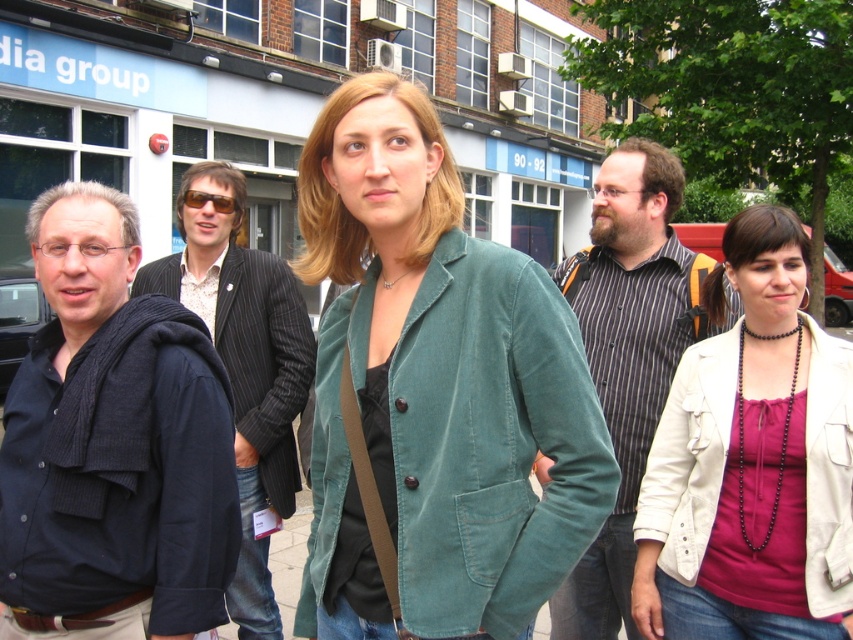
Question: Which object is positioned farthest from the striped cotton shirt at center?

Choices:
 (A) teal corduroy jacket at center
 (B) dark blue corduroy jacket at left

Answer: (B)

Question: Is dark blue corduroy jacket at left below white leather jacket at lower right?

Choices:
 (A) no
 (B) yes

Answer: (A)

Question: Which point appears closest to the camera in this image?

Choices:
 (A) (192, 426)
 (B) (259, 572)

Answer: (A)

Question: Which of these objects is positioned closest to the dark blue corduroy jacket at left?

Choices:
 (A) black pinstripe suit at center
 (B) teal corduroy jacket at center
 (C) striped cotton shirt at center
 (D) white leather jacket at lower right

Answer: (B)

Question: Is striped cotton shirt at center further to camera compared to white leather jacket at lower right?

Choices:
 (A) yes
 (B) no

Answer: (B)

Question: Can you confirm if dark blue corduroy jacket at left is thinner than black pinstripe suit at center?

Choices:
 (A) no
 (B) yes

Answer: (B)